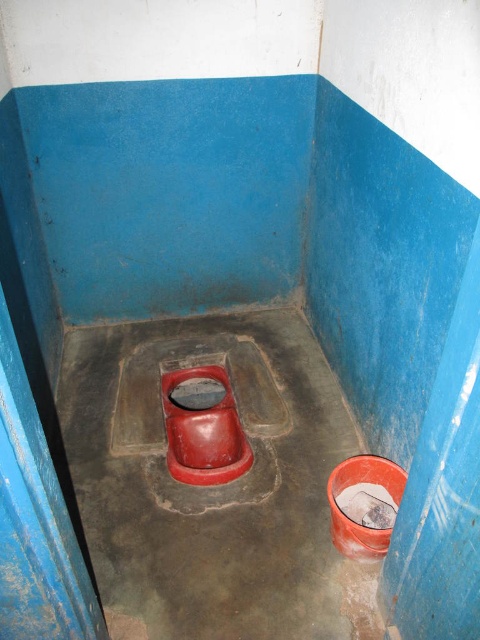
Question: Where is smooth plastic toilet at center located in relation to matte plastic toilet bowl at center in the image?

Choices:
 (A) above
 (B) below

Answer: (B)

Question: Which point is farther from the camera taking this photo?

Choices:
 (A) (332, 385)
 (B) (168, 424)

Answer: (A)

Question: Does smooth plastic toilet at center appear on the left side of matte plastic toilet bowl at center?

Choices:
 (A) yes
 (B) no

Answer: (B)

Question: Which of the following is the closest to the observer?

Choices:
 (A) (175, 456)
 (B) (206, 592)

Answer: (B)

Question: Does smooth plastic toilet at center have a lesser width compared to matte plastic toilet bowl at center?

Choices:
 (A) no
 (B) yes

Answer: (A)